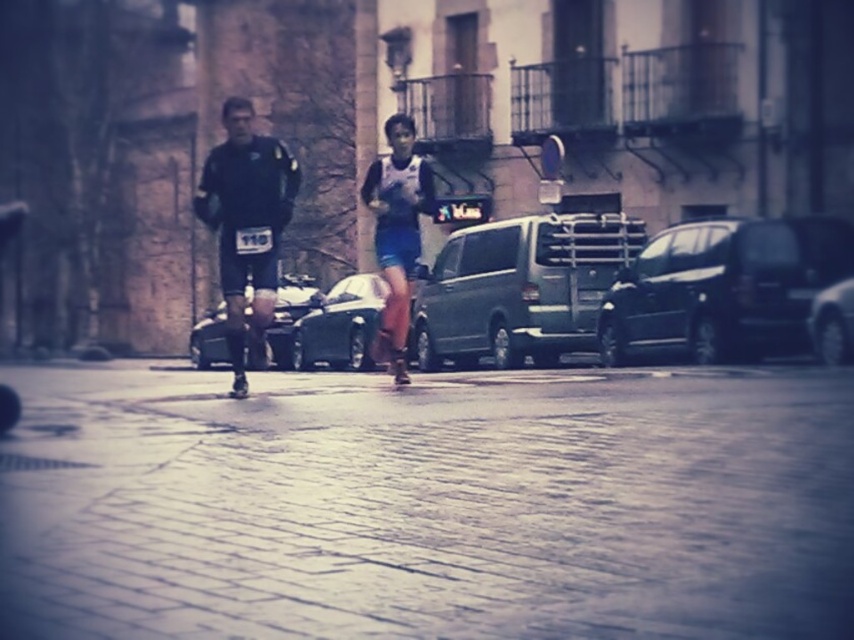
Does metallic gray van at center have a lesser height compared to shiny silver car at center?

No.

What do you see at coordinates (519, 289) in the screenshot? I see `metallic gray van at center` at bounding box center [519, 289].

Does point (455, 285) lie in front of point (847, 301)?

No, it is not.

Find the location of a particular element. metallic gray van at center is located at coordinates (519, 289).

Is point (238, 195) farther from camera compared to point (846, 301)?

No, (238, 195) is closer to viewer.

Is dark blue athletic wear at center bigger than shiny silver car at center?

Indeed, dark blue athletic wear at center has a larger size compared to shiny silver car at center.

This screenshot has height=640, width=854. What do you see at coordinates (247, 221) in the screenshot? I see `dark blue athletic wear at center` at bounding box center [247, 221].

This screenshot has width=854, height=640. I want to click on dark blue athletic wear at center, so click(x=247, y=221).

Does metallic silver van at center appear on the right side of matte black roller skate at center?

Incorrect, metallic silver van at center is not on the right side of matte black roller skate at center.

Between metallic silver van at center and matte black roller skate at center, which one is positioned higher?

Positioned higher is metallic silver van at center.

The height and width of the screenshot is (640, 854). I want to click on metallic silver van at center, so click(x=290, y=316).